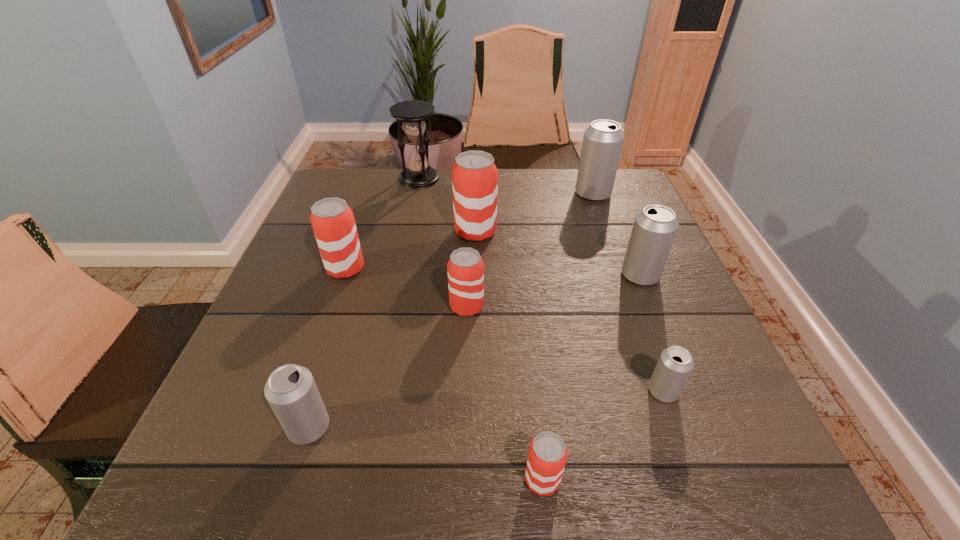
The width and height of the screenshot is (960, 540). I want to click on free region at the far edge of the desktop, so click(x=528, y=188).

In order to click on free space at the near edge of the desktop in this screenshot , I will do `click(414, 492)`.

Locate an element on the screen. The height and width of the screenshot is (540, 960). vacant space at the left edge of the desktop is located at coordinates (315, 268).

Identify the location of free location at the right edge of the desktop. This screenshot has width=960, height=540. (682, 302).

Where is `vacant space at the far left corner of the desktop`? This screenshot has height=540, width=960. vacant space at the far left corner of the desktop is located at coordinates (372, 204).

The image size is (960, 540). Identify the location of vacant space at the far right corner of the desktop. (630, 202).

Where is `free spot between the farthest orange beer can and the seventh farthest beer can`? Image resolution: width=960 pixels, height=540 pixels. free spot between the farthest orange beer can and the seventh farthest beer can is located at coordinates (392, 329).

Locate an element on the screen. empty space between the leftmost white beer can and the seventh farthest object is located at coordinates (486, 409).

The image size is (960, 540). I want to click on free space that is in between the third farthest object and the farthest white beer can, so click(534, 213).

The width and height of the screenshot is (960, 540). Identify the location of unoccupied position between the second smallest white beer can and the second farthest white beer can. (474, 351).